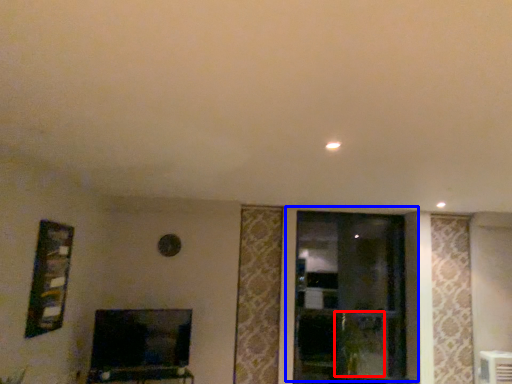
Question: Which point is further to the camera, plant (highlighted by a red box) or window (highlighted by a blue box)?

Choices:
 (A) plant
 (B) window

Answer: (B)